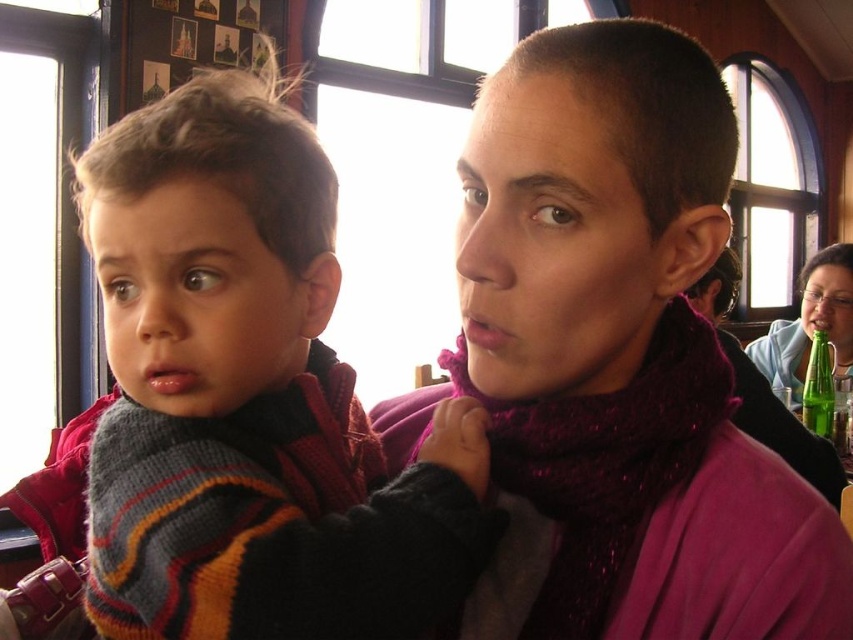
Who is lower down, maroon knitted scarf at center or woolen maroon scarf at center?

woolen maroon scarf at center

Does point (799, 488) come in front of point (694, 369)?

That is True.

Identify the location of maroon knitted scarf at center. This screenshot has height=640, width=853. (616, 362).

Which is more to the right, woolen maroon scarf at center or green glass bottle at upper right?

From the viewer's perspective, green glass bottle at upper right appears more on the right side.

Is woolen maroon scarf at center bigger than green glass bottle at upper right?

No, woolen maroon scarf at center is not bigger than green glass bottle at upper right.

Where is `woolen maroon scarf at center`? Image resolution: width=853 pixels, height=640 pixels. woolen maroon scarf at center is located at coordinates (611, 461).

Can you confirm if striped knit sweater at left is smaller than green glass bottle at upper right?

Yes.

Between point (314, 449) and point (769, 364), which one is positioned behind?

Point (769, 364)

Does point (202, 182) come farther from viewer compared to point (779, 372)?

No, it is not.

Locate an element on the screen. The image size is (853, 640). striped knit sweater at left is located at coordinates (250, 397).